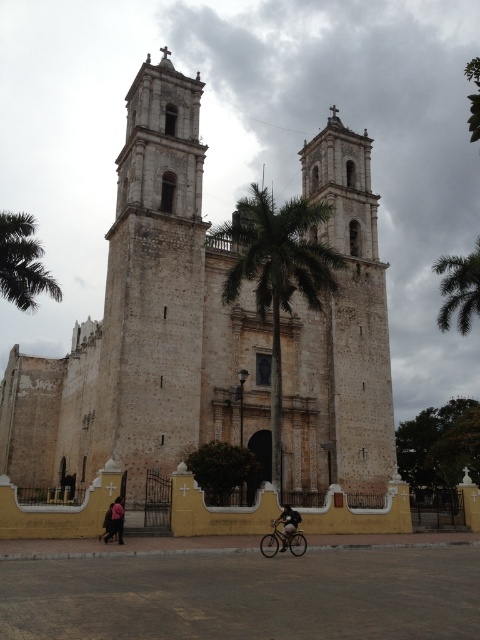
Who is shorter, white stone bell tower at center or green leafy palm tree at center?

green leafy palm tree at center

Locate an element on the screen. The height and width of the screenshot is (640, 480). white stone bell tower at center is located at coordinates (344, 330).

Does shiny silver bicycle at lower center have a lesser height compared to dark pink fabric at lower left?

Correct, shiny silver bicycle at lower center is not as tall as dark pink fabric at lower left.

Who is taller, shiny silver bicycle at lower center or dark pink fabric at lower left?

dark pink fabric at lower left

Is point (278, 532) positioned behind point (119, 515)?

That is True.

Find the location of a particular element. shiny silver bicycle at lower center is located at coordinates (283, 540).

Can you confirm if white stone cathedral at center is positioned to the right of dark pink fabric at lower left?

Indeed, white stone cathedral at center is positioned on the right side of dark pink fabric at lower left.

Looking at this image, is white stone cathedral at center positioned behind dark pink fabric at lower left?

That is False.

This screenshot has width=480, height=640. What do you see at coordinates (145, 324) in the screenshot?
I see `white stone cathedral at center` at bounding box center [145, 324].

The image size is (480, 640). In order to click on white stone cathedral at center in this screenshot , I will do `click(145, 324)`.